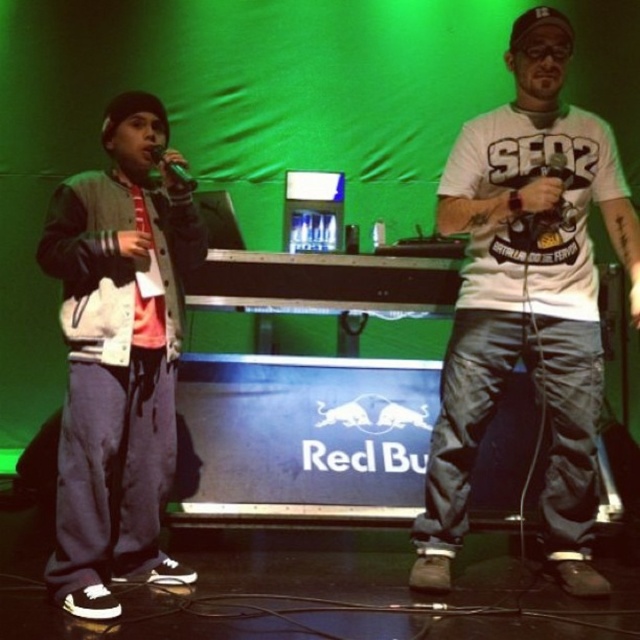
Is white matte t-shirt at center thinner than matte gray jacket at left?

Incorrect, white matte t-shirt at center's width is not less than matte gray jacket at left's.

Which is below, white matte t-shirt at center or matte gray jacket at left?

matte gray jacket at left is below.

Is point (536, 29) less distant than point (92, 481)?

No, it is behind (92, 481).

Identify the location of white matte t-shirt at center. coord(528,300).